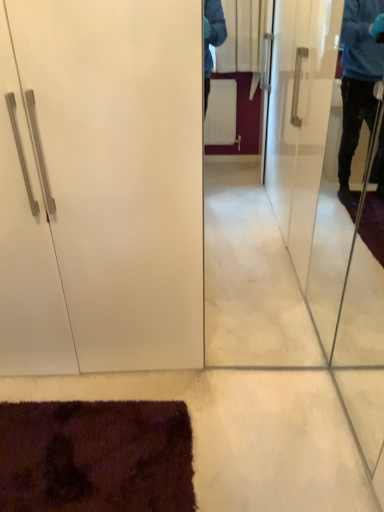
Question: Can we say white glossy cabinet at left lies outside transparent glass screen door at right?

Choices:
 (A) yes
 (B) no

Answer: (A)

Question: Are white glossy cabinet at left and transparent glass screen door at right beside each other?

Choices:
 (A) yes
 (B) no

Answer: (B)

Question: Is white glossy cabinet at left positioned in front of transparent glass screen door at right?

Choices:
 (A) yes
 (B) no

Answer: (B)

Question: Is transparent glass screen door at right completely or partially inside white glossy cabinet at left?

Choices:
 (A) yes
 (B) no

Answer: (B)

Question: From a real-world perspective, is white glossy cabinet at left beneath transparent glass screen door at right?

Choices:
 (A) no
 (B) yes

Answer: (A)

Question: Considering the relative sizes of white glossy cabinet at left and transparent glass screen door at right in the image provided, is white glossy cabinet at left smaller than transparent glass screen door at right?

Choices:
 (A) no
 (B) yes

Answer: (A)

Question: From the image's perspective, is transparent glass screen door at right above white glossy cabinet at left?

Choices:
 (A) yes
 (B) no

Answer: (B)

Question: Does transparent glass screen door at right turn towards white glossy cabinet at left?

Choices:
 (A) yes
 (B) no

Answer: (B)

Question: Can you confirm if transparent glass screen door at right is wider than white glossy cabinet at left?

Choices:
 (A) no
 (B) yes

Answer: (A)

Question: Are transparent glass screen door at right and white glossy cabinet at left beside each other?

Choices:
 (A) yes
 (B) no

Answer: (B)

Question: From a real-world perspective, is transparent glass screen door at right over white glossy cabinet at left?

Choices:
 (A) no
 (B) yes

Answer: (A)

Question: Is transparent glass screen door at right in front of white glossy cabinet at left?

Choices:
 (A) yes
 (B) no

Answer: (A)

Question: Does point (324, 271) appear closer or farther from the camera than point (175, 200)?

Choices:
 (A) closer
 (B) farther

Answer: (B)